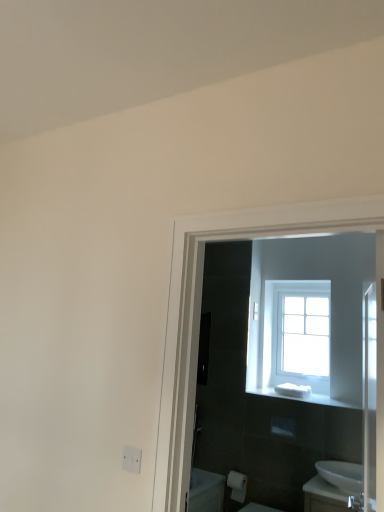
Question: Considering the relative sizes of white matte toilet paper at lower center and white glossy sink at lower right in the image provided, is white matte toilet paper at lower center smaller than white glossy sink at lower right?

Choices:
 (A) yes
 (B) no

Answer: (A)

Question: From a real-world perspective, is white matte toilet paper at lower center located higher than white glossy sink at lower right?

Choices:
 (A) no
 (B) yes

Answer: (A)

Question: Does white matte toilet paper at lower center appear on the right side of white glossy sink at lower right?

Choices:
 (A) yes
 (B) no

Answer: (B)

Question: Does white matte toilet paper at lower center have a larger size compared to white glossy sink at lower right?

Choices:
 (A) yes
 (B) no

Answer: (B)

Question: Is white matte toilet paper at lower center taller than white glossy sink at lower right?

Choices:
 (A) no
 (B) yes

Answer: (B)

Question: Based on their positions, is white glossy sink at lower right located to the left or right of white matte toilet paper at lower center?

Choices:
 (A) right
 (B) left

Answer: (A)

Question: In the image, is white glossy sink at lower right positioned in front of or behind white matte toilet paper at lower center?

Choices:
 (A) front
 (B) behind

Answer: (A)

Question: Is white glossy sink at lower right wider or thinner than white matte toilet paper at lower center?

Choices:
 (A) wide
 (B) thin

Answer: (A)

Question: Is point (x=339, y=480) positioned closer to the camera than point (x=241, y=481)?

Choices:
 (A) farther
 (B) closer

Answer: (B)

Question: Choose the correct answer: Is white matte toilet paper at lower center inside white plastic soap at center or outside it?

Choices:
 (A) outside
 (B) inside

Answer: (A)

Question: In terms of size, does white matte toilet paper at lower center appear bigger or smaller than white plastic soap at center?

Choices:
 (A) big
 (B) small

Answer: (B)

Question: Is point (246, 485) positioned closer to the camera than point (256, 389)?

Choices:
 (A) farther
 (B) closer

Answer: (B)

Question: Visually, is white matte toilet paper at lower center positioned to the left or to the right of white plastic soap at center?

Choices:
 (A) right
 (B) left

Answer: (B)

Question: Is white glossy sink at lower right taller or shorter than white plastic soap at center?

Choices:
 (A) short
 (B) tall

Answer: (B)

Question: Which is correct: white glossy sink at lower right is inside white plastic soap at center, or outside of it?

Choices:
 (A) inside
 (B) outside

Answer: (B)